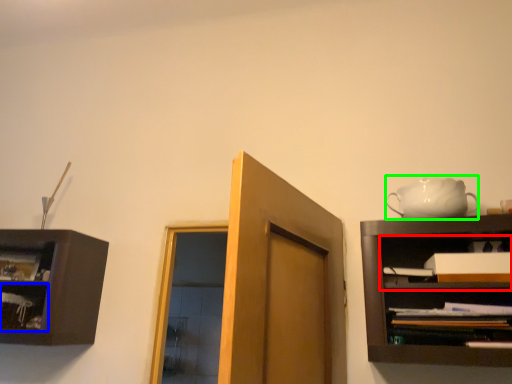
Question: Which object is positioned farthest from cabinet (highlighted by a red box)? Select from shelf (highlighted by a blue box) and tea set (highlighted by a green box).

Choices:
 (A) shelf
 (B) tea set

Answer: (A)